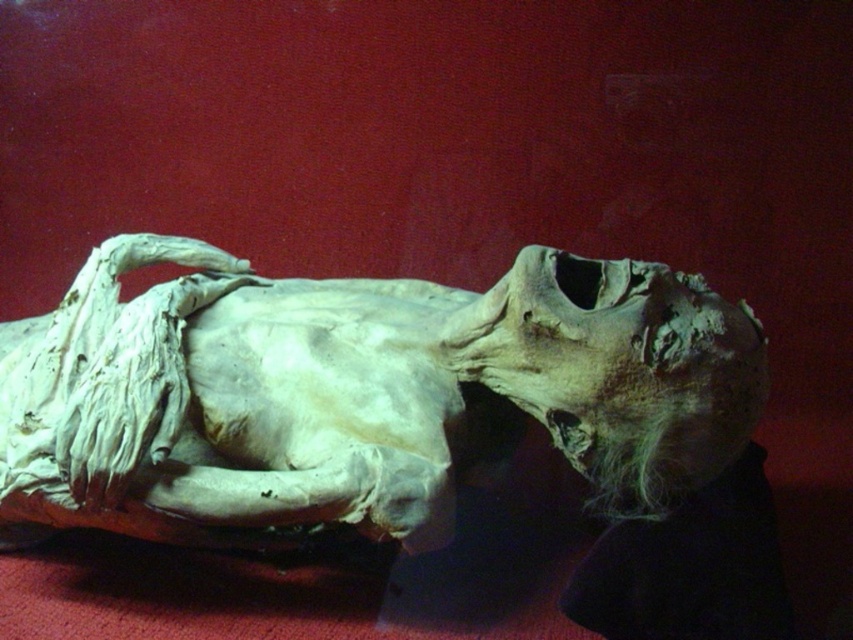
You are an archaeologist examining the mummy. You notice two points marked on the image at coordinates point (10,476) and point (625,449). Which point is closer to your eyes?

Point (10,476) is further to the viewer than point (625,449), so the point closer to your eyes is point (625,449).